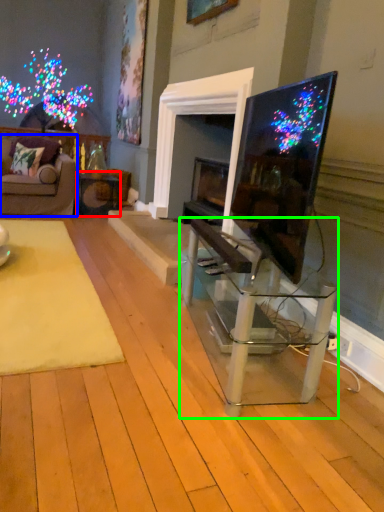
Question: Which object is the farthest from table (highlighted by a red box)? Choose among these: studio couch (highlighted by a blue box) or table (highlighted by a green box).

Choices:
 (A) studio couch
 (B) table

Answer: (B)